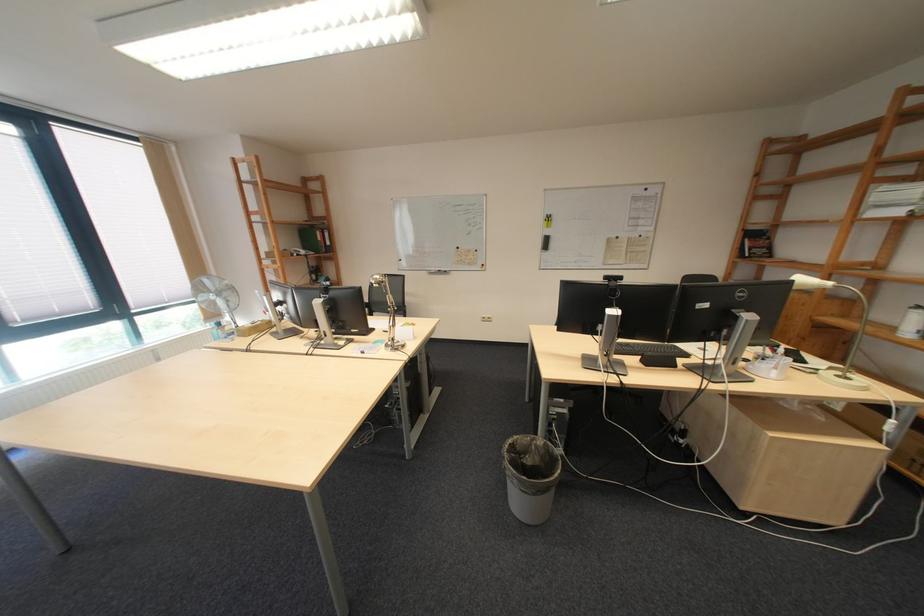
I want to click on black whiteboard eraser, so click(438, 270).